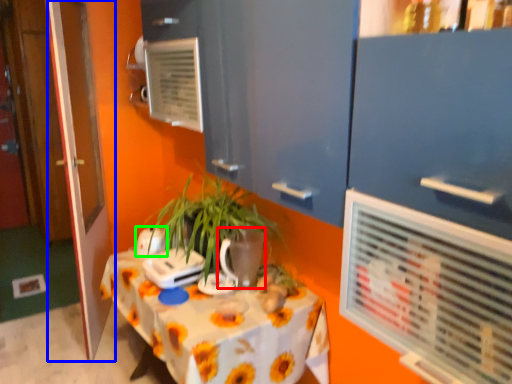
Question: Estimate the real-world distances between objects in this image. Which object is farther from flowerpot (highlighted by a red box), door (highlighted by a blue box) or appliance (highlighted by a green box)?

Choices:
 (A) door
 (B) appliance

Answer: (A)